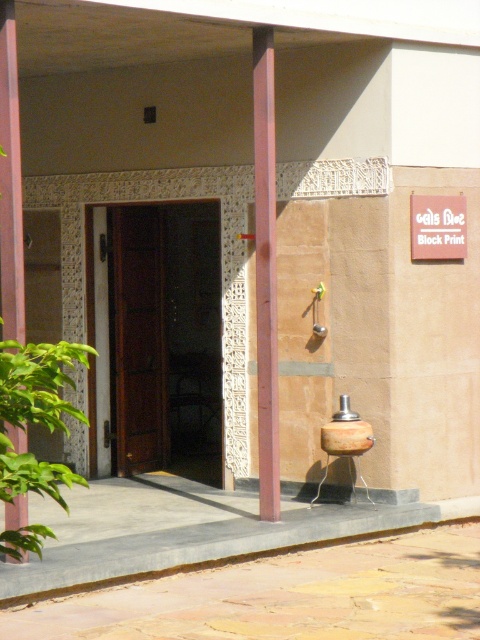
Locate an element on the screen. The image size is (480, 640). smooth pink pillar at left is located at coordinates (11, 182).

Is smooth pink pillar at left further to the viewer compared to white wood sign at upper right?

No, it is not.

Between point (9, 44) and point (410, 257), which one is positioned behind?

The point (410, 257) is more distant.

You are a GUI agent. You are given a task and a screenshot of the screen. Output one action in this format:
    pyautogui.click(x=<x>, y=<y>)
    Task: Click on the smooth pink pillar at left
    
    Given the screenshot: What is the action you would take?
    pyautogui.click(x=11, y=182)

Does smooth reddish-brown post at center appear on the left side of white wood sign at upper right?

Indeed, smooth reddish-brown post at center is positioned on the left side of white wood sign at upper right.

Identify the location of smooth reddish-brown post at center. (265, 272).

Does brown wooden door at center have a larger size compared to smooth pink pillar at left?

Correct, brown wooden door at center is larger in size than smooth pink pillar at left.

Does point (211, 224) come in front of point (24, 301)?

That is False.

Who is more forward, (99, 250) or (10, 120)?

Point (10, 120) is more forward.

The height and width of the screenshot is (640, 480). Find the location of `brown wooden door at center`. brown wooden door at center is located at coordinates (158, 339).